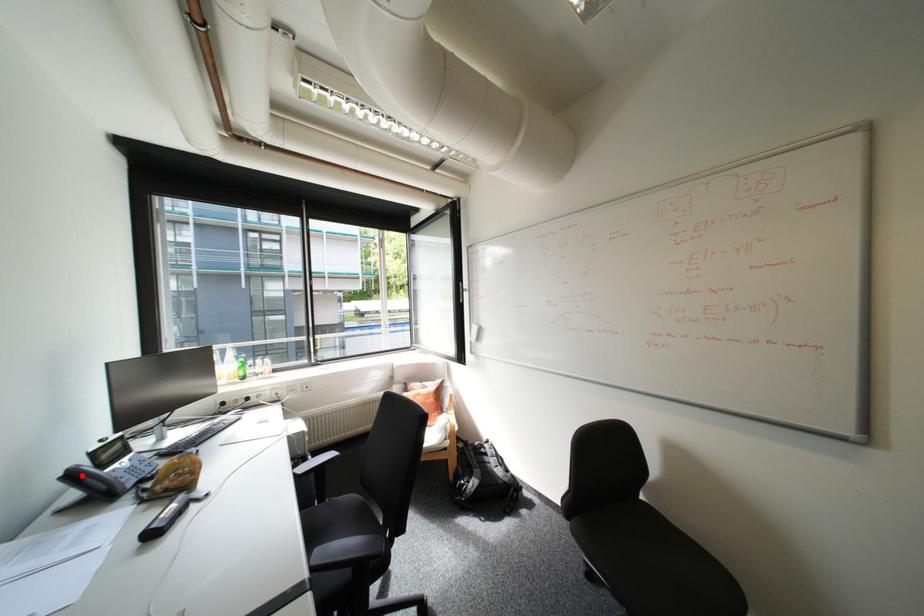
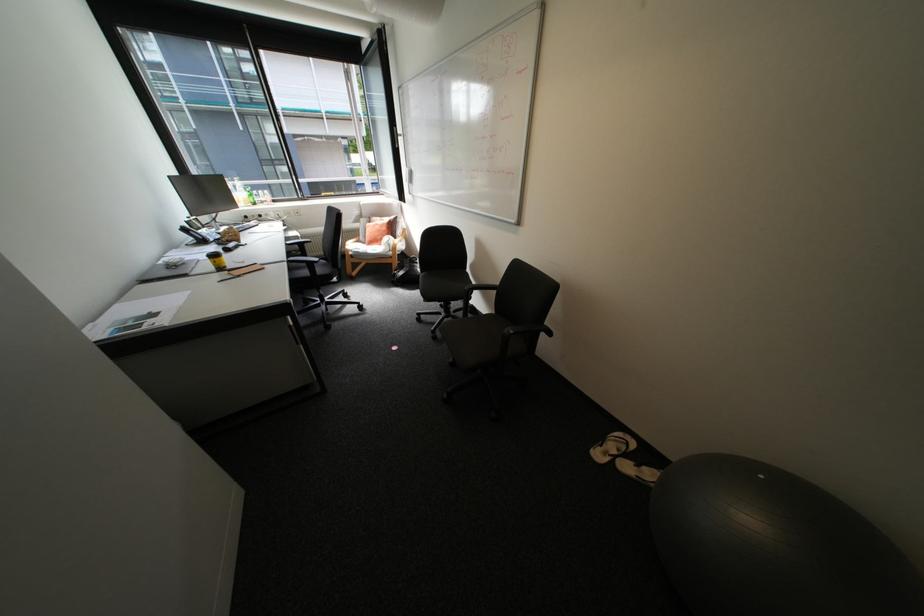
Find the pixel in the second image that matches the highlighted location in the first image.

(195, 230)